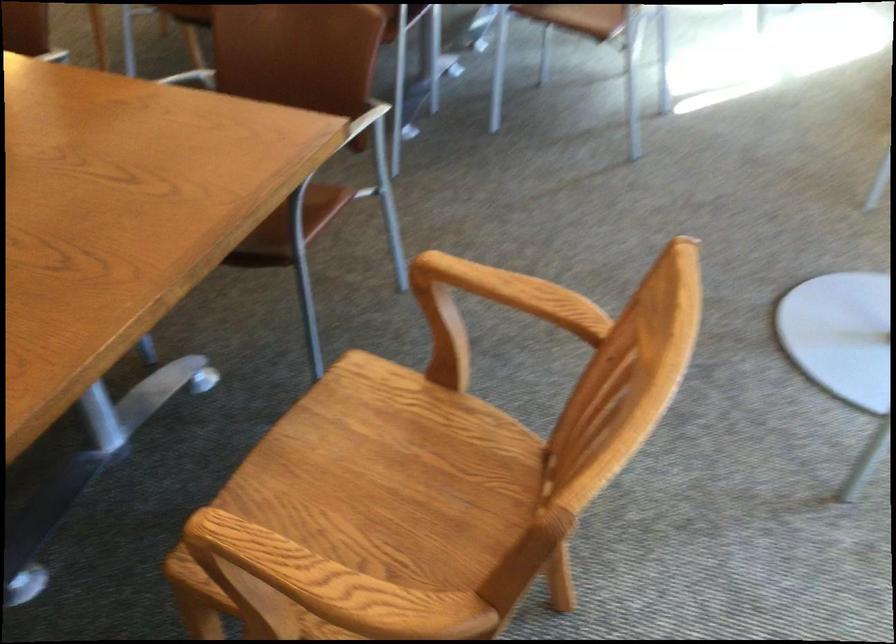
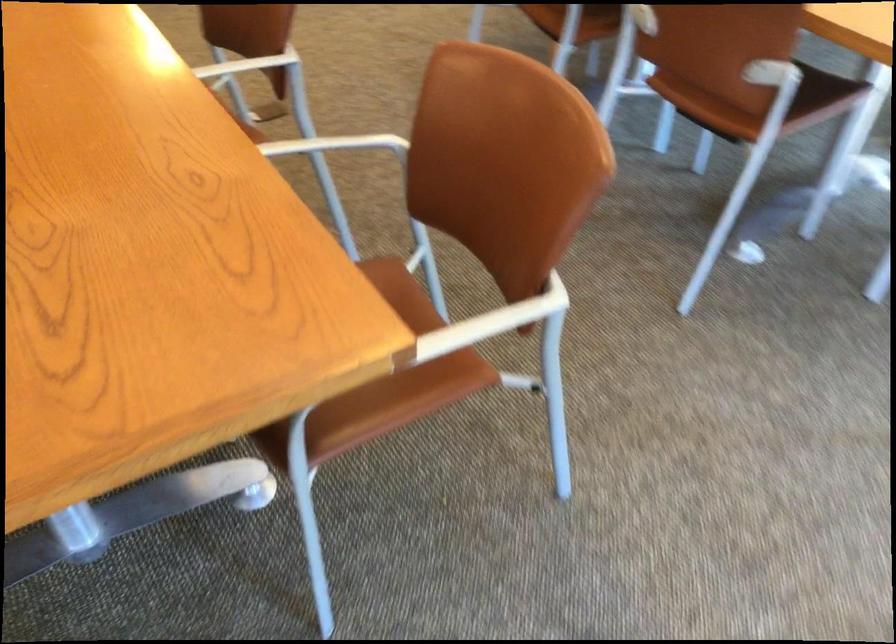
Question: Based on the continuous images, in which direction is the camera rotating? Reply with the corresponding letter.

Choices:
 (A) Left
 (B) Right
 (C) Up
 (D) Down

Answer: (A)